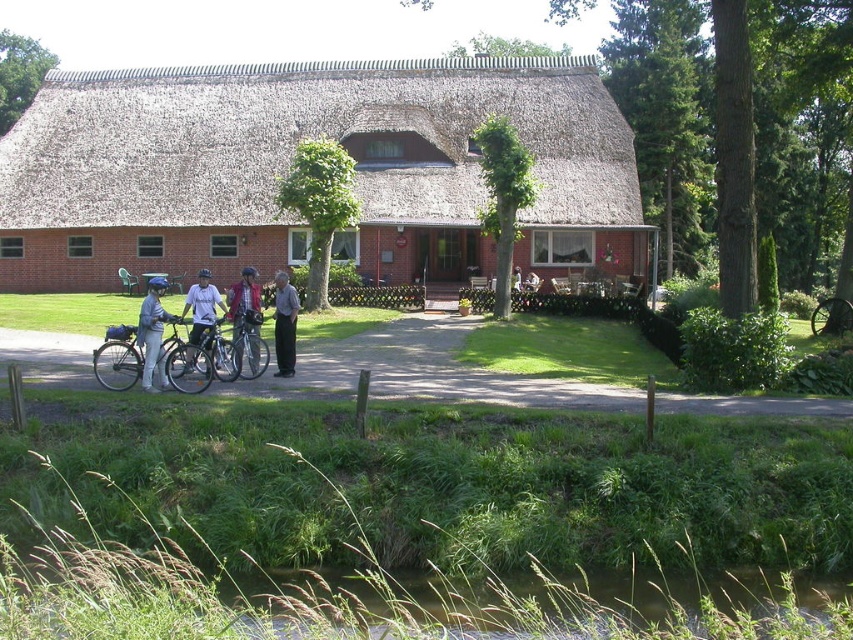
You are planning to cross the green grassy creek at lower center with your matte white bicycle at center. Can you safely ride your bicycle over the creek?

The green grassy creek at lower center is smaller than the matte white bicycle at center, so it is likely safe to ride the matte white bicycle at center over the creek as it may not obstruct the bicycle.

You are standing in front of the traditional brick house with a thatched roof. You see a green grassy creek at lower center and a matte white bicycle at center. Which object is shorter?

The green grassy creek at lower center is shorter than the matte white bicycle at center.

You are a cyclist who just arrived at the house. You see the matte black bicycle at lower left and the matte blue helmet at left. Which object is positioned more to the left side of the scene?

The matte blue helmet at left is positioned more to the left side of the scene because the matte black bicycle at lower left is to the right of it.